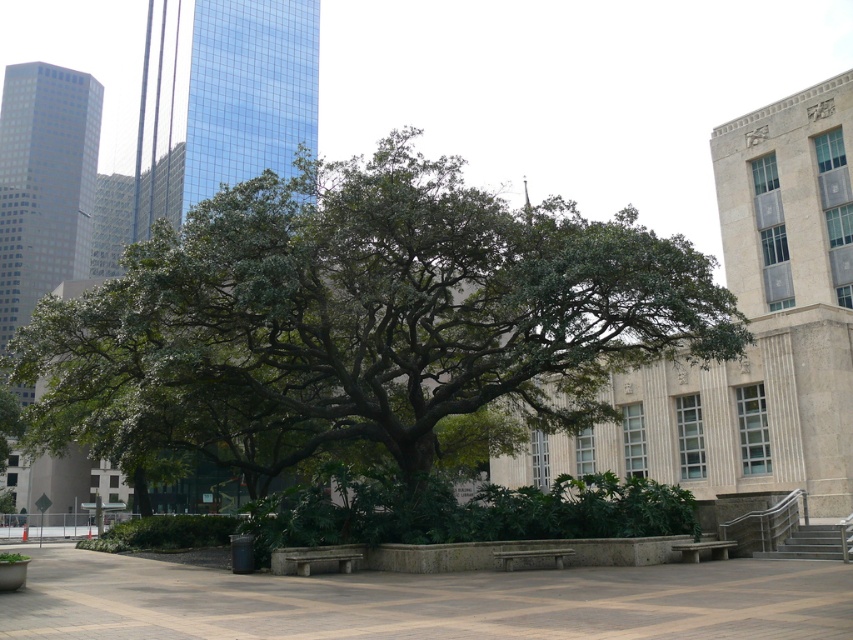
You are standing in the park and want to place a small statue between the two points, point (x=312, y=547) and point (x=546, y=548). Which point should the statue be closer to if you want it to be more visible to people approaching from the front of the tree?

The statue should be placed closer to point (x=312, y=547) because it is closer to the viewer, making it more visible to those approaching from the front of the tree.

You are a park visitor who wants to sit on the stone bench at center. Considering the space around the green leafy tree at center, do you think there is enough room for the bench to be placed without being under the tree?

The green leafy tree at center might be wider than stone bench at center, so there might not be enough space for the bench to be placed without overlapping with the tree. Please check the actual dimensions before deciding.